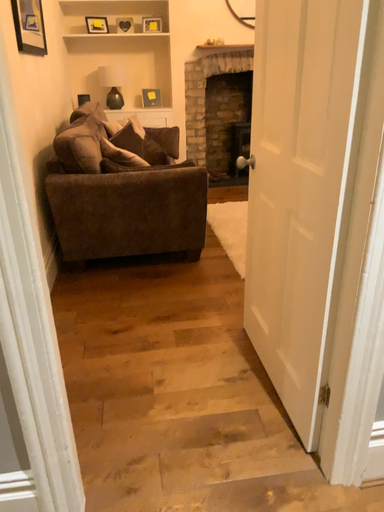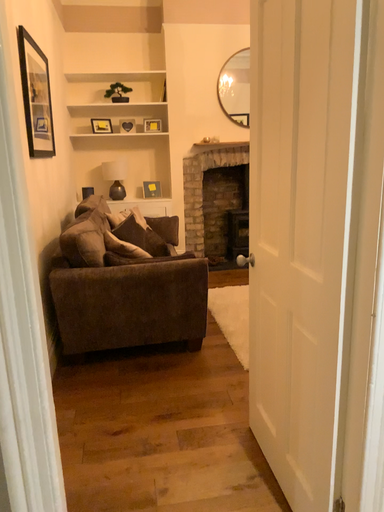
Question: How did the camera likely rotate when shooting the video?

Choices:
 (A) rotated upward
 (B) rotated downward

Answer: (A)